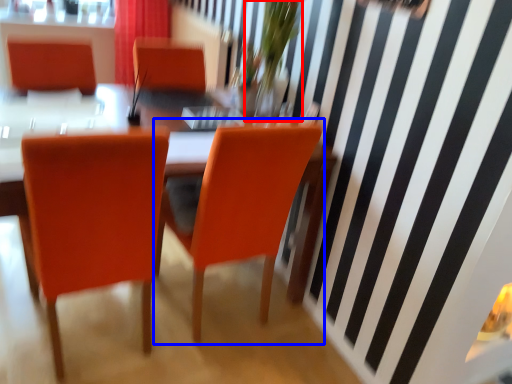
Question: Among these objects, which one is farthest to the camera, floral arrangement (highlighted by a red box) or chair (highlighted by a blue box)?

Choices:
 (A) floral arrangement
 (B) chair

Answer: (A)